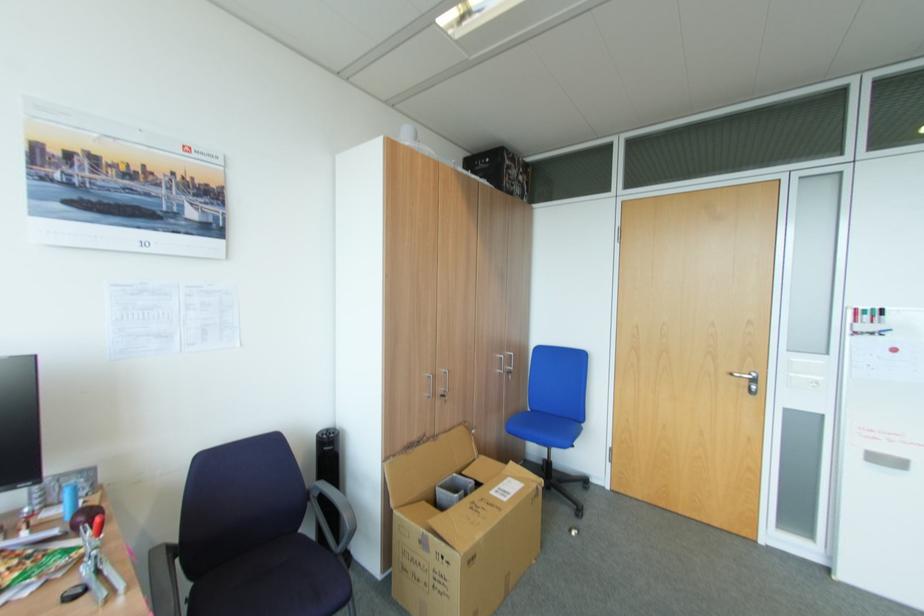
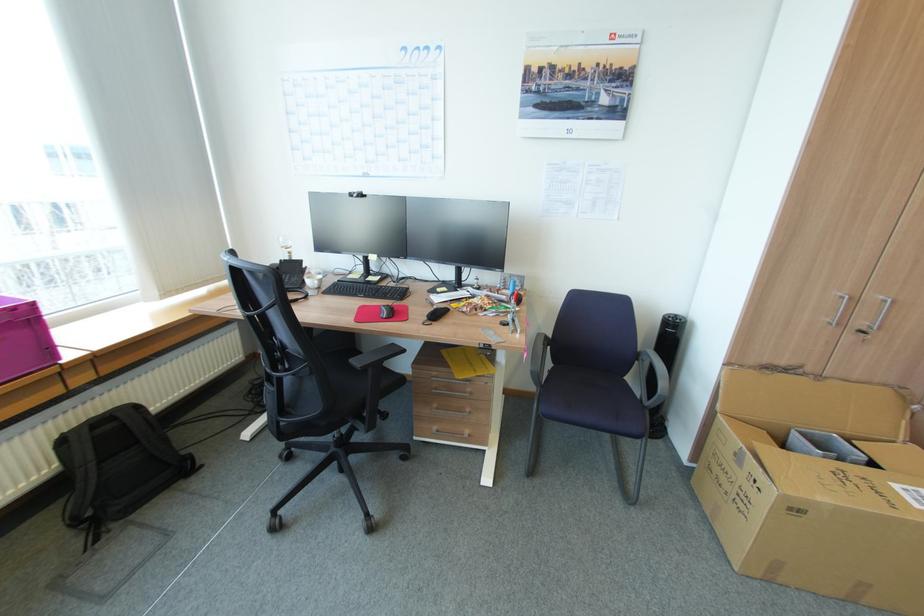
The point at (x=434, y=397) is marked in the first image. Where is the corresponding point in the second image?

(833, 323)